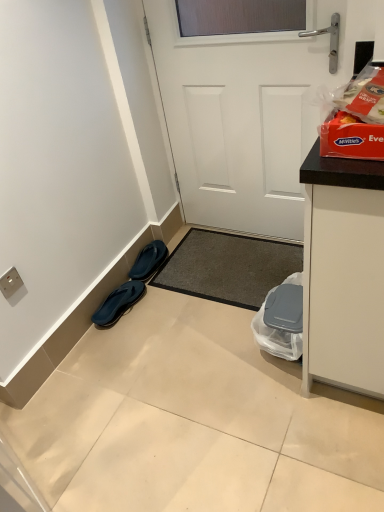
Find the location of `vacant area to the right of black rubber flip-flops at lower left, which is counted as the 1th footwear, starting from the top`. vacant area to the right of black rubber flip-flops at lower left, which is counted as the 1th footwear, starting from the top is located at coordinates (184, 261).